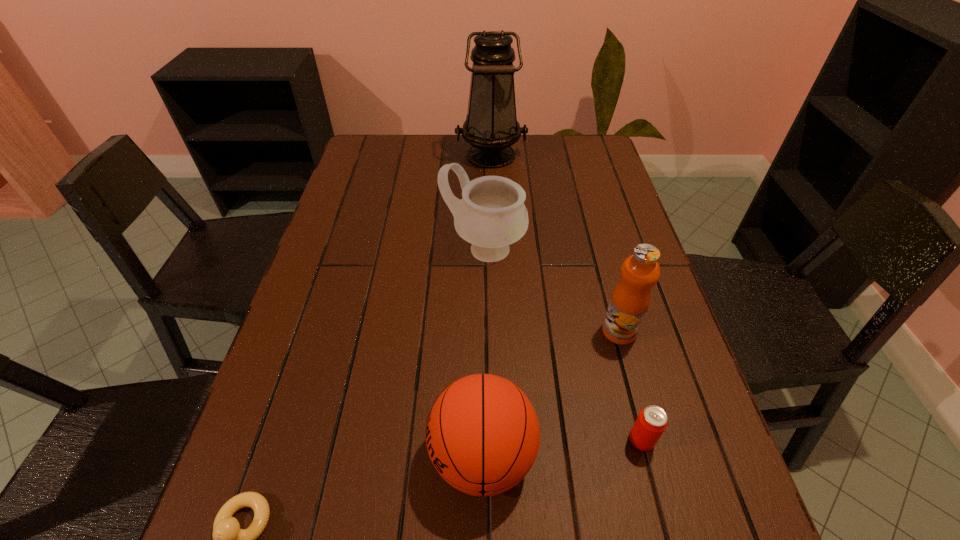
Find the location of a particular element. Image resolution: width=960 pixels, height=540 pixels. free space located 0.200m on the side with logo of the fourth tallest object is located at coordinates click(x=321, y=456).

The image size is (960, 540). I want to click on free location located 0.230m on the side with logo of the fourth tallest object, so click(304, 456).

Where is `free space located on the back of the second shortest object`? free space located on the back of the second shortest object is located at coordinates (609, 314).

Where is `object positioned at the far edge`? object positioned at the far edge is located at coordinates (491, 127).

Where is `fruit juice at the right edge`? This screenshot has width=960, height=540. fruit juice at the right edge is located at coordinates (631, 297).

Image resolution: width=960 pixels, height=540 pixels. What are the coordinates of `beer can present at the right edge` in the screenshot? It's located at (650, 424).

Find the location of a particular element. vacant space at the left edge of the desktop is located at coordinates (355, 173).

This screenshot has height=540, width=960. Find the location of `vacant space at the right edge of the desktop`. vacant space at the right edge of the desktop is located at coordinates (593, 259).

Identify the location of vacant space at the far left corner. (379, 159).

You are a GUI agent. You are given a task and a screenshot of the screen. Output one action in this format:
    pyautogui.click(x=<x>, y=<y>)
    Task: Click on the vacant region at the far right corner of the desktop
    
    Given the screenshot: What is the action you would take?
    pyautogui.click(x=574, y=140)